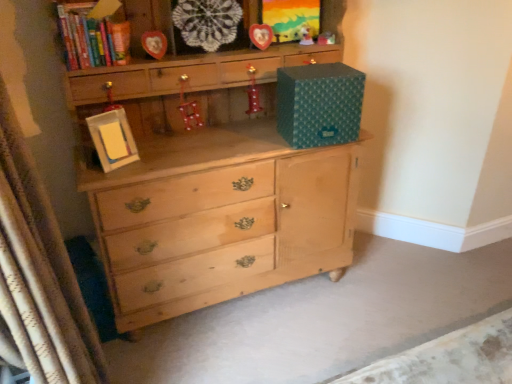
Question: Considering the relative positions of shiny red boot at center, the second toy when ordered from left to right, and teal paper storage box at upper right in the image provided, is shiny red boot at center, the second toy when ordered from left to right, behind teal paper storage box at upper right?

Choices:
 (A) yes
 (B) no

Answer: (A)

Question: Can you confirm if shiny red boot at center, the second toy positioned from the bottom, is thinner than teal paper storage box at upper right?

Choices:
 (A) yes
 (B) no

Answer: (A)

Question: Does shiny red boot at center, the second toy positioned from the bottom, turn towards teal paper storage box at upper right?

Choices:
 (A) no
 (B) yes

Answer: (A)

Question: From a real-world perspective, is shiny red boot at center, which ranks as the 3th toy in top-to-bottom order, positioned under teal paper storage box at upper right based on gravity?

Choices:
 (A) no
 (B) yes

Answer: (A)

Question: Is shiny red boot at center, the second toy when ordered from left to right, turned away from teal paper storage box at upper right?

Choices:
 (A) no
 (B) yes

Answer: (A)

Question: Considering the relative positions of shiny red boot at center, the second toy when ordered from left to right, and teal paper storage box at upper right in the image provided, is shiny red boot at center, the second toy when ordered from left to right, to the right of teal paper storage box at upper right from the viewer's perspective?

Choices:
 (A) yes
 (B) no

Answer: (B)

Question: From a real-world perspective, is wooden heart-shaped frame at upper center, the 1th picture frame in the top-to-bottom sequence, physically below white cardboard picture frame at center, placed as the first picture frame when sorted from left to right?

Choices:
 (A) no
 (B) yes

Answer: (A)

Question: Is wooden heart-shaped frame at upper center, the 1th picture frame in the top-to-bottom sequence, at the left side of white cardboard picture frame at center, placed as the first picture frame when sorted from left to right?

Choices:
 (A) no
 (B) yes

Answer: (A)

Question: Is the depth of wooden heart-shaped frame at upper center, the fourth picture frame when ordered from left to right, less than that of white cardboard picture frame at center, the first picture frame from the bottom?

Choices:
 (A) yes
 (B) no

Answer: (B)

Question: Is the depth of wooden heart-shaped frame at upper center, the 1th picture frame in the top-to-bottom sequence, greater than that of white cardboard picture frame at center, the fourth picture frame positioned from the right?

Choices:
 (A) no
 (B) yes

Answer: (B)

Question: Could white cardboard picture frame at center, arranged as the fourth picture frame when viewed from the top, be considered to be inside wooden heart-shaped frame at upper center, the 1th picture frame viewed from the right?

Choices:
 (A) yes
 (B) no

Answer: (B)

Question: Is wooden heart-shaped frame at upper center, the 1th picture frame in the top-to-bottom sequence, smaller than white cardboard picture frame at center, the fourth picture frame positioned from the right?

Choices:
 (A) no
 (B) yes

Answer: (B)

Question: From the image's perspective, is white textured curtain at left below hardcover book at upper left?

Choices:
 (A) no
 (B) yes

Answer: (B)